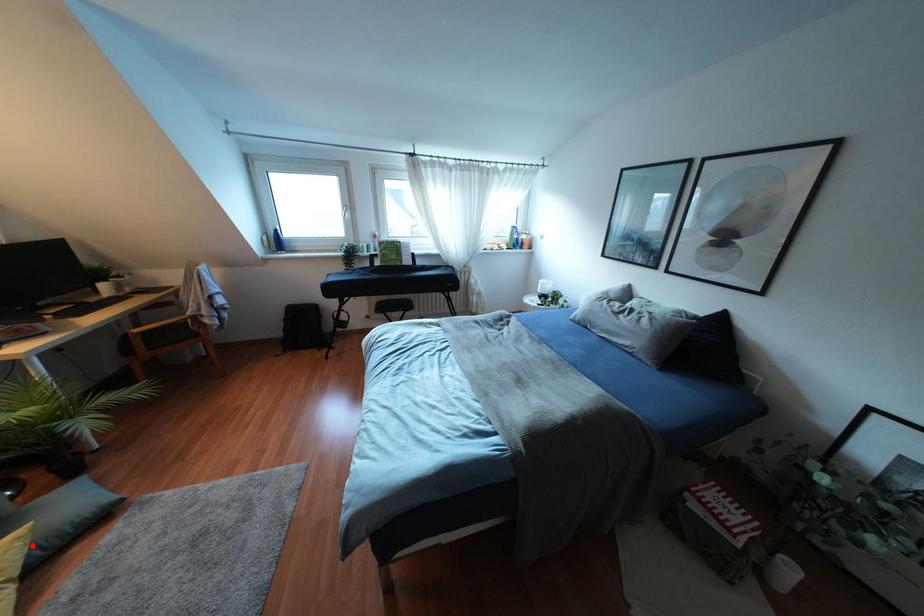
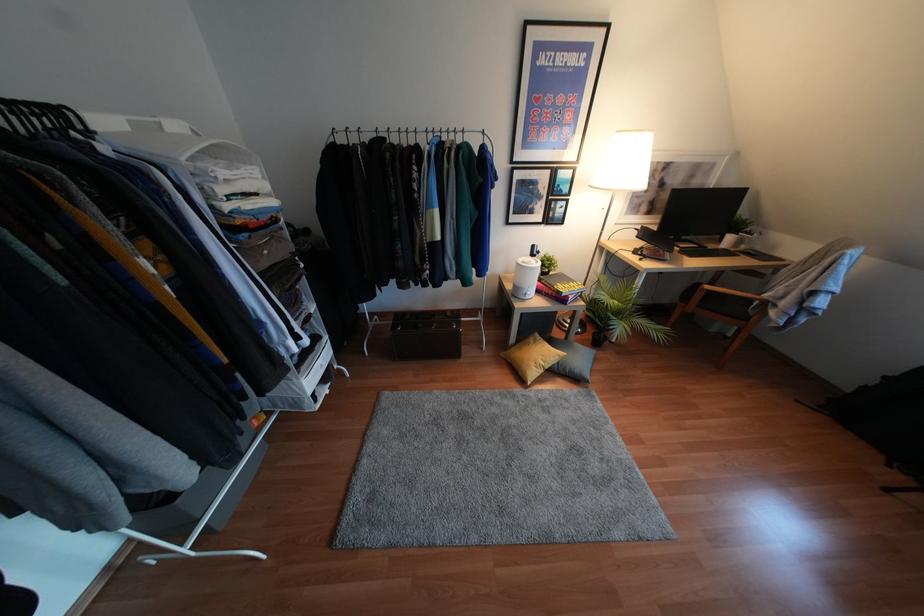
Locate, in the second image, the point that corresponds to the highlighted location in the first image.

(556, 362)